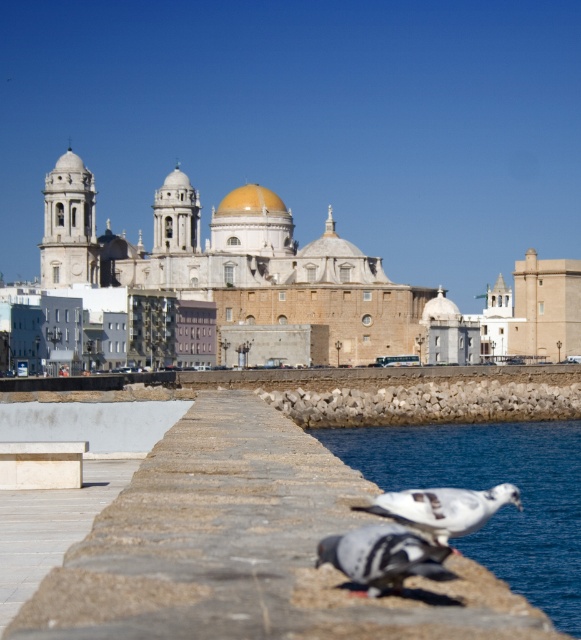
Question: Which object appears closest to the camera in this image?

Choices:
 (A) blue water at lower right
 (B) white matte pigeon at lower center
 (C) gray matte pigeon at lower center

Answer: (C)

Question: Is the position of gray matte pigeon at lower center less distant than that of white matte pigeon at lower center?

Choices:
 (A) yes
 (B) no

Answer: (A)

Question: Does blue water at lower right appear on the left side of white matte pigeon at lower center?

Choices:
 (A) no
 (B) yes

Answer: (A)

Question: Which object is the closest to the blue water at lower right?

Choices:
 (A) gray matte pigeon at lower center
 (B) white matte pigeon at lower center

Answer: (B)

Question: Can you confirm if blue water at lower right is positioned to the right of white matte pigeon at lower center?

Choices:
 (A) no
 (B) yes

Answer: (B)

Question: Which of the following is the closest to the observer?

Choices:
 (A) (450, 502)
 (B) (371, 548)

Answer: (B)